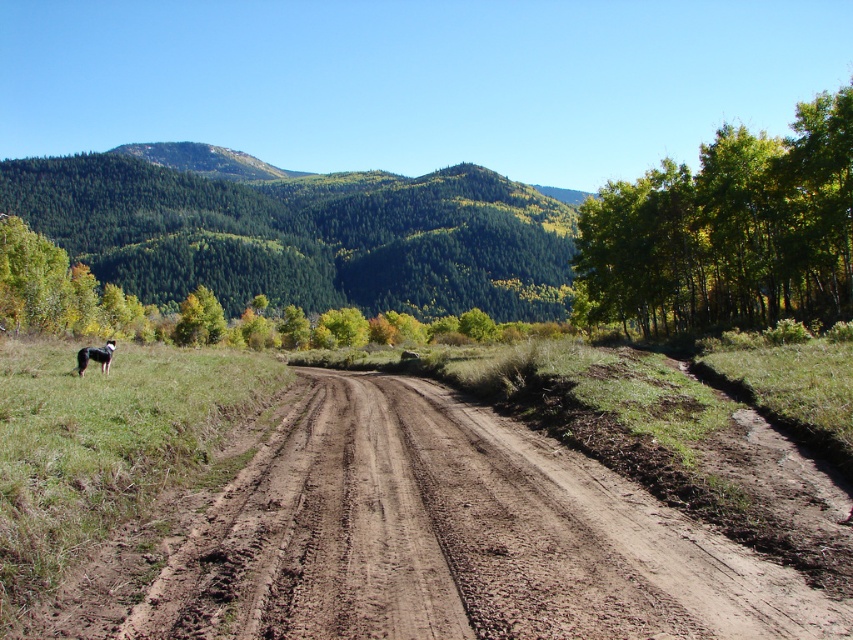
Question: Does green leafy trees at right have a lesser width compared to black fur dog at lower left?

Choices:
 (A) yes
 (B) no

Answer: (B)

Question: Is brown dirt track at center to the right of black fur dog at lower left from the viewer's perspective?

Choices:
 (A) yes
 (B) no

Answer: (A)

Question: Can you confirm if green forested hillside at upper left is thinner than black fur dog at lower left?

Choices:
 (A) yes
 (B) no

Answer: (B)

Question: Among these points, which one is farthest from the camera?

Choices:
 (A) (247, 236)
 (B) (166, 508)
 (C) (621, 250)
 (D) (85, 349)

Answer: (A)

Question: Which point is farther from the camera taking this photo?

Choices:
 (A) tap(836, 605)
 (B) tap(830, 205)
 (C) tap(96, 355)
 (D) tap(85, 170)

Answer: (D)

Question: Which object appears closest to the camera in this image?

Choices:
 (A) black fur dog at lower left
 (B) brown dirt track at center
 (C) green leafy trees at right

Answer: (B)